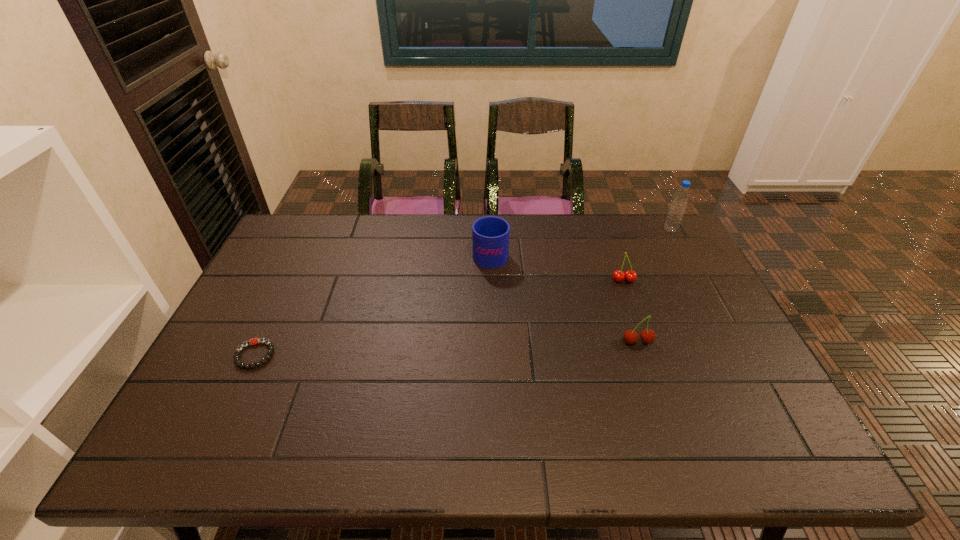
Find the location of a particular element. vacant point located on the side with the handle of the fourth object from right to left is located at coordinates (490, 223).

Where is `vacant space located on the side with the handle of the fourth object from right to left`? The image size is (960, 540). vacant space located on the side with the handle of the fourth object from right to left is located at coordinates point(490,230).

The height and width of the screenshot is (540, 960). I want to click on free space located 0.180m on the surface of the nearer cherry, so click(x=660, y=408).

At what (x,y) coordinates should I click in order to perform the action: click on vacant region located with the stems of the third farthest object pointing upwards. Please return your answer as a coordinate pair (x, y). The image size is (960, 540). Looking at the image, I should click on [638, 321].

Find the location of a particular element. The height and width of the screenshot is (540, 960). vacant space situated on the back of the leftmost object is located at coordinates (269, 326).

This screenshot has width=960, height=540. I want to click on water bottle at the far edge, so click(x=678, y=205).

You are a GUI agent. You are given a task and a screenshot of the screen. Output one action in this format:
    pyautogui.click(x=<x>, y=<y>)
    Task: Click on the mug present at the far edge
    This screenshot has width=960, height=540.
    Given the screenshot: What is the action you would take?
    pyautogui.click(x=490, y=235)

Find the location of a particular element. This screenshot has height=540, width=960. object located in the left edge section of the desktop is located at coordinates (253, 341).

You are a GUI agent. You are given a task and a screenshot of the screen. Output one action in this format:
    pyautogui.click(x=<x>, y=<y>)
    Task: Click on the object that is at the right edge
    
    Given the screenshot: What is the action you would take?
    pyautogui.click(x=678, y=205)

Locate an element on the screen. The height and width of the screenshot is (540, 960). object at the far right corner is located at coordinates (678, 205).